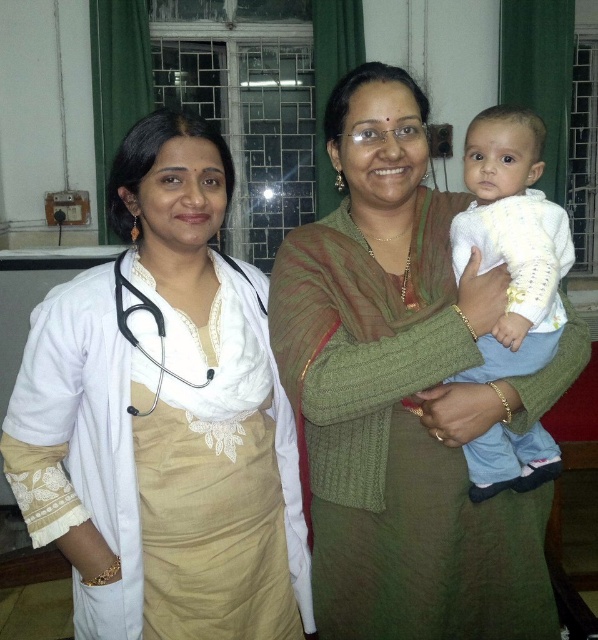
Can you confirm if white soft fabric baby at center is shorter than white matte stethoscope at left?

Incorrect, white soft fabric baby at center's height does not fall short of white matte stethoscope at left's.

Who is lower down, white soft fabric baby at center or white matte stethoscope at left?

white matte stethoscope at left

I want to click on white soft fabric baby at center, so click(512, 241).

What are the coordinates of `white soft fabric baby at center` in the screenshot? It's located at (512, 241).

Measure the distance between white lace dress at left and camera.

The distance of white lace dress at left from camera is 3.90 feet.

What do you see at coordinates (163, 417) in the screenshot? I see `white lace dress at left` at bounding box center [163, 417].

I want to click on white lace dress at left, so click(x=163, y=417).

Does green knitted sweater at center have a greater height compared to white soft fabric baby at center?

Correct, green knitted sweater at center is much taller as white soft fabric baby at center.

Does green knitted sweater at center have a smaller size compared to white soft fabric baby at center?

No, green knitted sweater at center is not smaller than white soft fabric baby at center.

Does point (313, 323) lie behind point (499, 435)?

No, (313, 323) is in front of (499, 435).

This screenshot has width=598, height=640. In order to click on green knitted sweater at center in this screenshot , I will do 404,394.